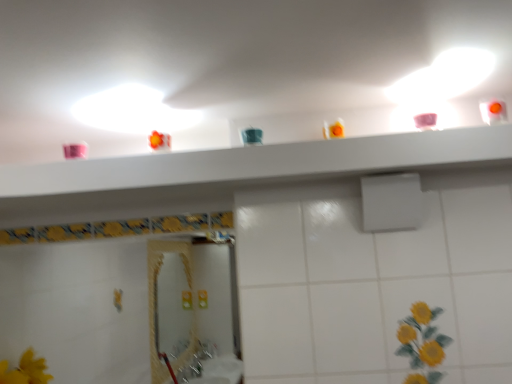
Question: From the image's perspective, is white matte shower at center located beneath white glossy shelf at upper center?

Choices:
 (A) no
 (B) yes

Answer: (B)

Question: Does white matte shower at center have a greater width compared to white glossy shelf at upper center?

Choices:
 (A) yes
 (B) no

Answer: (B)

Question: From a real-world perspective, does white matte shower at center stand above white glossy shelf at upper center?

Choices:
 (A) yes
 (B) no

Answer: (B)

Question: Is white matte shower at center to the right of white glossy shelf at upper center from the viewer's perspective?

Choices:
 (A) no
 (B) yes

Answer: (B)

Question: Does white matte shower at center have a lesser height compared to white glossy shelf at upper center?

Choices:
 (A) yes
 (B) no

Answer: (B)

Question: Does white matte shower at center turn towards white glossy shelf at upper center?

Choices:
 (A) no
 (B) yes

Answer: (A)

Question: Is white glossy shelf at upper center positioned in front of white matte shower at center?

Choices:
 (A) yes
 (B) no

Answer: (A)

Question: Does white glossy shelf at upper center lie behind white matte shower at center?

Choices:
 (A) no
 (B) yes

Answer: (A)

Question: Considering the relative sizes of white glossy shelf at upper center and white matte shower at center in the image provided, is white glossy shelf at upper center thinner than white matte shower at center?

Choices:
 (A) no
 (B) yes

Answer: (A)

Question: From the image's perspective, does white glossy shelf at upper center appear higher than white matte shower at center?

Choices:
 (A) yes
 (B) no

Answer: (A)

Question: From the image's perspective, is white glossy shelf at upper center located beneath white matte shower at center?

Choices:
 (A) no
 (B) yes

Answer: (A)

Question: Considering the relative sizes of white glossy shelf at upper center and white matte shower at center in the image provided, is white glossy shelf at upper center bigger than white matte shower at center?

Choices:
 (A) no
 (B) yes

Answer: (B)

Question: From a real-world perspective, relative to white matte shower at center, is white glossy shelf at upper center vertically above or below?

Choices:
 (A) above
 (B) below

Answer: (A)